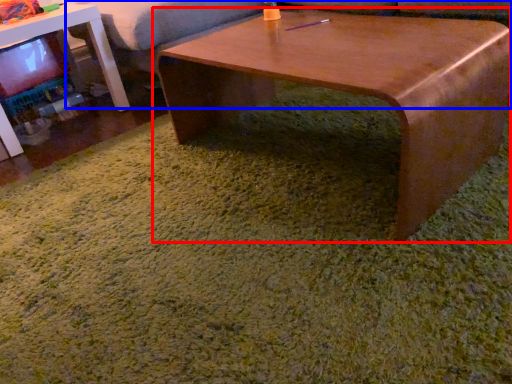
Question: Which object is further to the camera taking this photo, coffee table (highlighted by a red box) or couch (highlighted by a blue box)?

Choices:
 (A) coffee table
 (B) couch

Answer: (B)